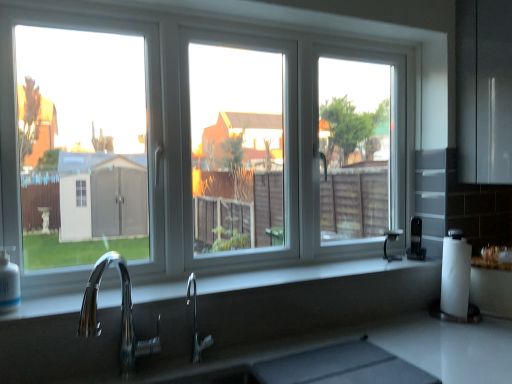
Identify the location of black plastic coffee maker at right. (416, 241).

Describe the element at coordinates (353, 41) in the screenshot. I see `white plastic window at center` at that location.

Find the location of `chrome/metallic faucet at lower left, the second tap from the right`. chrome/metallic faucet at lower left, the second tap from the right is located at coordinates (121, 314).

What is the approximate height of smooth gray countertop at center?

It is 0.89 inches.

The width and height of the screenshot is (512, 384). In order to click on black plastic coffee maker at right in this screenshot , I will do `click(416, 241)`.

Is smooth gray countertop at center taller than white plastic window at center?

In fact, smooth gray countertop at center may be shorter than white plastic window at center.

In the scene shown: From a real-world perspective, between smooth gray countertop at center and white plastic window at center, who is vertically lower?

smooth gray countertop at center.

Is smooth gray countertop at center smaller than white plastic window at center?

Correct, smooth gray countertop at center occupies less space than white plastic window at center.

Is smooth gray countertop at center looking in the opposite direction of white plastic window at center?

Yes, white plastic window at center is at the back of smooth gray countertop at center.

From a real-world perspective, is chrome/metallic faucet at lower left, acting as the first tap starting from the left, physically located above or below smooth gray countertop at center?

From a real-world perspective, chrome/metallic faucet at lower left, acting as the first tap starting from the left, is physically below smooth gray countertop at center.

Is chrome/metallic faucet at lower left, which appears as the 1th tap when viewed from the front, oriented towards smooth gray countertop at center?

No.

Is chrome/metallic faucet at lower left, acting as the first tap starting from the left, not near smooth gray countertop at center?

That's not correct — chrome/metallic faucet at lower left, acting as the first tap starting from the left, is a little close to smooth gray countertop at center.

From the image's perspective, between chrome/metallic faucet at lower left, the second tap from the right, and smooth gray countertop at center, who is located below?

chrome/metallic faucet at lower left, the second tap from the right, appears lower in the image.

How different are the orientations of chrome/metallic faucet at lower left, the second tap from the right, and black plastic coffee maker at right in degrees?

The facing directions of chrome/metallic faucet at lower left, the second tap from the right, and black plastic coffee maker at right are 1.31 degrees apart.

Based on the photo, is chrome/metallic faucet at lower left, acting as the first tap starting from the left, outside of black plastic coffee maker at right?

Yes.

Considering the sizes of objects chrome/metallic faucet at lower left, acting as the second tap starting from the back, and black plastic coffee maker at right in the image provided, who is wider, chrome/metallic faucet at lower left, acting as the second tap starting from the back, or black plastic coffee maker at right?

With larger width is chrome/metallic faucet at lower left, acting as the second tap starting from the back.

Relative to black plastic coffee maker at right, is chrome/metallic faucet at lower left, the second tap from the right, in front or behind?

chrome/metallic faucet at lower left, the second tap from the right, is positioned closer to the viewer than black plastic coffee maker at right.

Find the location of a particular element. Image resolution: width=512 pixels, height=384 pixels. the 2nd tap to the left of the black plastic coffee maker at right, starting your count from the anchor is located at coordinates (121, 314).

Are black plastic coffee maker at right and chrome/metallic faucet at lower left, acting as the second tap starting from the back, far apart?

Indeed, black plastic coffee maker at right is not near chrome/metallic faucet at lower left, acting as the second tap starting from the back.

Considering the sizes of objects black plastic coffee maker at right and chrome/metallic faucet at lower left, acting as the first tap starting from the left, in the image provided, who is shorter, black plastic coffee maker at right or chrome/metallic faucet at lower left, acting as the first tap starting from the left,?

Standing shorter between the two is black plastic coffee maker at right.

Is black plastic coffee maker at right at the back of smooth gray countertop at center?

No, black plastic coffee maker at right is not at the back of smooth gray countertop at center.

How different are the orientations of smooth gray countertop at center and black plastic coffee maker at right in degrees?

0.00397 degrees.

Between smooth gray countertop at center and black plastic coffee maker at right, which one appears on the left side from the viewer's perspective?

From the viewer's perspective, smooth gray countertop at center appears more on the left side.

The height and width of the screenshot is (384, 512). I want to click on appliance to the right of smooth gray countertop at center, so click(x=416, y=241).

From a real-world perspective, who is located higher, black plastic coffee maker at right or smooth gray countertop at center?

In real-world perspective, black plastic coffee maker at right is above.

Is black plastic coffee maker at right oriented away from smooth gray countertop at center?

No, black plastic coffee maker at right is not facing away from smooth gray countertop at center.

Where is `tap positioned vertically above the polished chrome faucet at center, placed as the 2th tap when sorted from front to back (from a real-world perspective)`? The height and width of the screenshot is (384, 512). tap positioned vertically above the polished chrome faucet at center, placed as the 2th tap when sorted from front to back (from a real-world perspective) is located at coordinates (121, 314).

In terms of height, does polished chrome faucet at center, the first tap viewed from the right, look taller or shorter compared to chrome/metallic faucet at lower left, the second tap from the right?

Considering their sizes, polished chrome faucet at center, the first tap viewed from the right, has less height than chrome/metallic faucet at lower left, the second tap from the right.

Based on their sizes in the image, would you say polished chrome faucet at center, placed as the 2th tap when sorted from front to back, is bigger or smaller than chrome/metallic faucet at lower left, which appears as the 1th tap when viewed from the front?

Considering their sizes, polished chrome faucet at center, placed as the 2th tap when sorted from front to back, takes up less space than chrome/metallic faucet at lower left, which appears as the 1th tap when viewed from the front.

This screenshot has width=512, height=384. Identify the location of window lying behind the smooth gray countertop at center. (353, 41).

At what (x,y) coordinates should I click in order to perform the action: click on tap that is the 1st object located below the smooth gray countertop at center (from the image's perspective). Please return your answer as a coordinate pair (x, y). Looking at the image, I should click on (121, 314).

Which object lies further to the anchor point white plastic window at center, chrome/metallic faucet at lower left, acting as the second tap starting from the back, or polished chrome faucet at center, which is counted as the 2th tap, starting from the left?

polished chrome faucet at center, which is counted as the 2th tap, starting from the left.

From the image, which object appears to be farther from chrome/metallic faucet at lower left, which appears as the 1th tap when viewed from the front, black plastic coffee maker at right or polished chrome faucet at center, the first tap viewed from the right?

Among the two, black plastic coffee maker at right is located further to chrome/metallic faucet at lower left, which appears as the 1th tap when viewed from the front.

Looking at the image, which one is located closer to chrome/metallic faucet at lower left, the second tap from the right, polished chrome faucet at center, the first tap viewed from the right, or white plastic window at center?

polished chrome faucet at center, the first tap viewed from the right, is positioned closer to the anchor chrome/metallic faucet at lower left, the second tap from the right.

Estimate the real-world distances between objects in this image. Which object is closer to white plastic window at center, black plastic coffee maker at right or polished chrome faucet at center, placed as the 2th tap when sorted from front to back?

Among the two, black plastic coffee maker at right is located nearer to white plastic window at center.

Looking at the image, which one is located closer to black plastic coffee maker at right, smooth gray countertop at center or chrome/metallic faucet at lower left, acting as the first tap starting from the left?

smooth gray countertop at center lies closer to black plastic coffee maker at right than the other object.

Which object lies nearer to the anchor point smooth gray countertop at center, polished chrome faucet at center, which is counted as the 2th tap, starting from the left, or black plastic coffee maker at right?

Based on the image, polished chrome faucet at center, which is counted as the 2th tap, starting from the left, appears to be nearer to smooth gray countertop at center.

Based on their spatial positions, is white plastic window at center or chrome/metallic faucet at lower left, acting as the second tap starting from the back, closer to black plastic coffee maker at right?

white plastic window at center is positioned closer to the anchor black plastic coffee maker at right.

Looking at the image, which one is located closer to black plastic coffee maker at right, chrome/metallic faucet at lower left, acting as the first tap starting from the left, or polished chrome faucet at center, which is counted as the 2th tap, starting from the left?

The object closer to black plastic coffee maker at right is polished chrome faucet at center, which is counted as the 2th tap, starting from the left.

Find the location of `counter top between white plastic window at center and polished chrome faucet at center, which is counted as the 2th tap, starting from the left, in the vertical direction`. counter top between white plastic window at center and polished chrome faucet at center, which is counted as the 2th tap, starting from the left, in the vertical direction is located at coordinates (330, 278).

At what (x,y) coordinates should I click in order to perform the action: click on window between chrome/metallic faucet at lower left, which appears as the 1th tap when viewed from the front, and black plastic coffee maker at right from left to right. Please return your answer as a coordinate pair (x, y). Image resolution: width=512 pixels, height=384 pixels. Looking at the image, I should click on (353, 41).

Identify the location of counter top between chrome/metallic faucet at lower left, acting as the first tap starting from the left, and black plastic coffee maker at right. The width and height of the screenshot is (512, 384). (330, 278).

This screenshot has height=384, width=512. What are the coordinates of `counter top between white plastic window at center and chrome/metallic faucet at lower left, acting as the first tap starting from the left, in the vertical direction` in the screenshot? It's located at (330, 278).